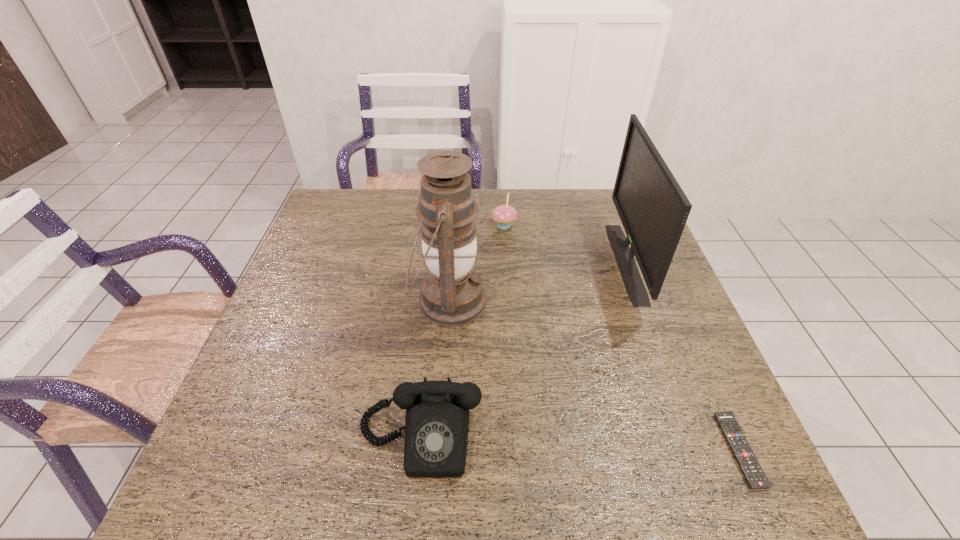
Identify the location of free point located 0.330m on the front-facing side of the monitor. (500, 262).

At what (x,y) coordinates should I click in order to perform the action: click on vacant region located 0.310m on the front of the cupcake. Please return your answer as a coordinate pair (x, y). The width and height of the screenshot is (960, 540). Looking at the image, I should click on (510, 307).

The width and height of the screenshot is (960, 540). I want to click on vacant region located on the back of the shortest object, so click(674, 301).

Image resolution: width=960 pixels, height=540 pixels. Identify the location of monitor located at the far edge. (653, 208).

Locate an element on the screen. cupcake situated at the far edge is located at coordinates (504, 215).

Where is `telephone present at the near edge`? telephone present at the near edge is located at coordinates (436, 427).

Locate an element on the screen. This screenshot has height=540, width=960. remote control at the near edge is located at coordinates (745, 457).

At what (x,y) coordinates should I click in order to perform the action: click on monitor that is at the right edge. Please return your answer as a coordinate pair (x, y). Looking at the image, I should click on pos(653,208).

The image size is (960, 540). In order to click on remote control located in the right edge section of the desktop in this screenshot , I will do `click(745, 457)`.

Identify the location of object located at the far right corner. (653, 208).